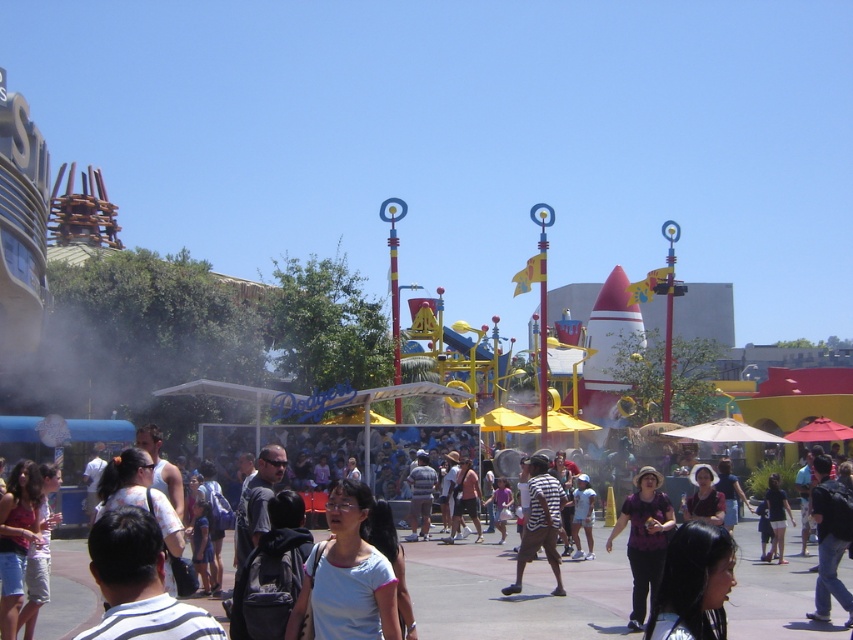
Is the position of purple matte shirt at center more distant than that of striped fabric shirt at center?

No, purple matte shirt at center is closer to the viewer.

Does purple matte shirt at center appear under striped fabric shirt at center?

Correct, purple matte shirt at center is located below striped fabric shirt at center.

Is point (653, 580) closer to viewer compared to point (531, 456)?

That is True.

Image resolution: width=853 pixels, height=640 pixels. I want to click on purple matte shirt at center, so click(643, 540).

Is matte white crowd at center taller than white matte shirt at center?

Correct, matte white crowd at center is much taller as white matte shirt at center.

Is matte white crowd at center bigger than white matte shirt at center?

Yes.

Find the location of a particular element. The image size is (853, 640). matte white crowd at center is located at coordinates pos(517,595).

Is white matte shirt at center bigger than purple matte shirt at center?

No, white matte shirt at center is not bigger than purple matte shirt at center.

Between white matte shirt at center and purple matte shirt at center, which one has less height?

Standing shorter between the two is white matte shirt at center.

Between point (363, 593) and point (643, 618), which one is positioned behind?

The point (643, 618) is more distant.

You are a GUI agent. You are given a task and a screenshot of the screen. Output one action in this format:
    pyautogui.click(x=<x>, y=<y>)
    Task: Click on the white matte shirt at center
    Image resolution: width=853 pixels, height=640 pixels.
    Given the screenshot: What is the action you would take?
    pyautogui.click(x=347, y=577)